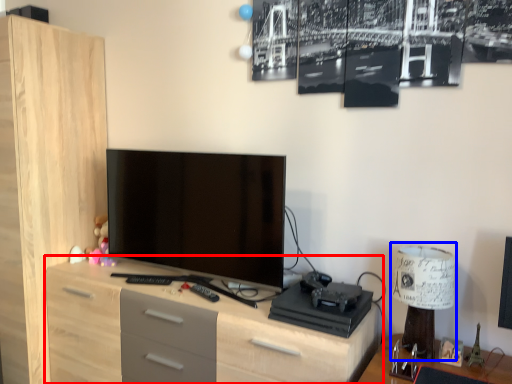
Question: Which object appears closest to the camera in this image, chest of drawers (highlighted by a red box) or table lamp (highlighted by a blue box)?

Choices:
 (A) chest of drawers
 (B) table lamp

Answer: (A)